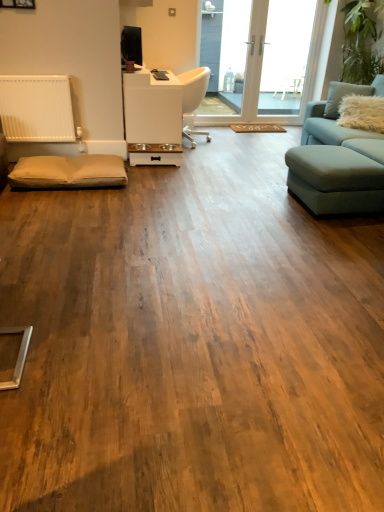
Where is `beige fabric footrest at lower left`? beige fabric footrest at lower left is located at coordinates (68, 172).

You are a GUI agent. You are given a task and a screenshot of the screen. Output one action in this format:
    pyautogui.click(x=<x>, y=<y>)
    Task: Click on the white glossy table at center
    
    Given the screenshot: What is the action you would take?
    pyautogui.click(x=153, y=118)

What do you see at coordinates (153, 118) in the screenshot?
I see `white glossy table at center` at bounding box center [153, 118].

Image resolution: width=384 pixels, height=512 pixels. What do you see at coordinates (262, 67) in the screenshot?
I see `transparent glass door at upper center, the second window screen viewed from the right` at bounding box center [262, 67].

I want to click on beige fabric footrest at lower left, so click(x=68, y=172).

Considering the positions of points (326, 11) and (124, 167), is point (326, 11) closer to camera compared to point (124, 167)?

No.

Who is shorter, transparent glass door at upper center, placed as the first window screen when sorted from left to right, or beige fabric footrest at lower left?

beige fabric footrest at lower left.

Measure the distance between beige fabric footrest at lower left and light blue fabric couch at right.

beige fabric footrest at lower left and light blue fabric couch at right are 1.88 meters apart from each other.

Is beige fabric footrest at lower left bigger or smaller than light blue fabric couch at right?

Clearly, beige fabric footrest at lower left is smaller in size than light blue fabric couch at right.

Based on the photo, is beige fabric footrest at lower left positioned before light blue fabric couch at right?

No, the depth of beige fabric footrest at lower left is greater than that of light blue fabric couch at right.

Which of these two, beige fabric footrest at lower left or light blue fabric couch at right, is wider?

light blue fabric couch at right is wider.

Are transparent glass door at upper center, placed as the first window screen when sorted from left to right, and fuzzy white pillow at upper right making contact?

No.

From a real-world perspective, relative to fuzzy white pillow at upper right, is transparent glass door at upper center, the second window screen viewed from the right, vertically above or below?

transparent glass door at upper center, the second window screen viewed from the right, is above fuzzy white pillow at upper right.

Does transparent glass door at upper center, the second window screen viewed from the right, contain fuzzy white pillow at upper right?

No, fuzzy white pillow at upper right is not surrounded by transparent glass door at upper center, the second window screen viewed from the right.

Which object is wider, transparent glass door at upper center, placed as the first window screen when sorted from left to right, or fuzzy white pillow at upper right?

With larger width is fuzzy white pillow at upper right.

Considering the relative positions of light blue fabric couch at right and transparent glass door at upper center, the second window screen viewed from the right, in the image provided, is light blue fabric couch at right to the right of transparent glass door at upper center, the second window screen viewed from the right, from the viewer's perspective?

Yes, light blue fabric couch at right is to the right of transparent glass door at upper center, the second window screen viewed from the right.

Which is more distant, (379,94) or (259,28)?

Positioned behind is point (259,28).

From a real-world perspective, which is physically below, light blue fabric couch at right or transparent glass door at upper center, the second window screen viewed from the right?

light blue fabric couch at right.

Is light blue fabric couch at right thinner than transparent glass door at upper center, placed as the first window screen when sorted from left to right?

No, light blue fabric couch at right is not thinner than transparent glass door at upper center, placed as the first window screen when sorted from left to right.

Is fuzzy white pillow at upper right aimed at white glossy table at center?

No, fuzzy white pillow at upper right is not turned towards white glossy table at center.

From the image's perspective, is fuzzy white pillow at upper right located above or below white glossy table at center?

fuzzy white pillow at upper right is situated higher than white glossy table at center in the image.

In terms of width, does fuzzy white pillow at upper right look wider or thinner when compared to white glossy table at center?

Considering their sizes, fuzzy white pillow at upper right looks slimmer than white glossy table at center.

Visually, is fuzzy white pillow at upper right positioned to the left or to the right of white glossy table at center?

In the image, fuzzy white pillow at upper right appears on the right side of white glossy table at center.

Is fuzzy white pillow at upper right smaller than transparent glass door at upper center, placed as the first window screen when sorted from left to right?

Yes.

How many degrees apart are the facing directions of fuzzy white pillow at upper right and transparent glass door at upper center, the second window screen viewed from the right?

The angle between the facing direction of fuzzy white pillow at upper right and the facing direction of transparent glass door at upper center, the second window screen viewed from the right, is 20.8 degrees.

Which is more to the right, fuzzy white pillow at upper right or transparent glass door at upper center, placed as the first window screen when sorted from left to right?

From the viewer's perspective, fuzzy white pillow at upper right appears more on the right side.

Choose the correct answer: Is fuzzy white pillow at upper right inside transparent glass door at upper center, placed as the first window screen when sorted from left to right, or outside it?

The correct answer is: outside.

Is beige fabric footrest at lower left oriented towards transparent glass door at upper center, the second window screen viewed from the right?

No.

From the image's perspective, which is above, beige fabric footrest at lower left or transparent glass door at upper center, placed as the first window screen when sorted from left to right?

From the image's view, transparent glass door at upper center, placed as the first window screen when sorted from left to right, is above.

Could transparent glass door at upper center, placed as the first window screen when sorted from left to right, be considered to be inside beige fabric footrest at lower left?

Definitely not — transparent glass door at upper center, placed as the first window screen when sorted from left to right, is not inside beige fabric footrest at lower left.

This screenshot has width=384, height=512. I want to click on the footrest directly beneath the transparent glass door at upper center, the second window screen viewed from the right (from a real-world perspective), so click(x=68, y=172).

This screenshot has width=384, height=512. In order to click on footrest behind the light blue fabric couch at right in this screenshot , I will do `click(68, 172)`.

Looking at the image, which one is located closer to beige fabric footrest at lower left, white glossy table at center or transparent glass door at upper right, marked as the 2th window screen in a left-to-right arrangement?

white glossy table at center is closer to beige fabric footrest at lower left.

Which object lies nearer to the anchor point light blue fabric couch at right, fuzzy white pillow at upper right or beige fabric footrest at lower left?

The object closer to light blue fabric couch at right is fuzzy white pillow at upper right.

Based on their spatial positions, is white plastic chair at center or white glossy table at center closer to beige fabric footrest at lower left?

The object closer to beige fabric footrest at lower left is white glossy table at center.

In the scene shown: Considering their positions, is fuzzy white pillow at upper right positioned closer to beige fabric footrest at lower left than transparent glass door at upper center, the second window screen viewed from the right?

transparent glass door at upper center, the second window screen viewed from the right, is closer to beige fabric footrest at lower left.

Estimate the real-world distances between objects in this image. Which object is further from transparent glass door at upper right, marked as the 2th window screen in a left-to-right arrangement, light blue fabric couch at right or white plastic chair at center?

Based on the image, light blue fabric couch at right appears to be further to transparent glass door at upper right, marked as the 2th window screen in a left-to-right arrangement.

Looking at the image, which one is located closer to beige fabric footrest at lower left, light blue fabric couch at right or white plastic chair at center?

light blue fabric couch at right lies closer to beige fabric footrest at lower left than the other object.

Estimate the real-world distances between objects in this image. Which object is further from light blue fabric couch at right, white plastic chair at center or transparent glass door at upper center, the second window screen viewed from the right?

Among the two, white plastic chair at center is located further to light blue fabric couch at right.

When comparing their distances from white glossy table at center, does beige fabric footrest at lower left or fuzzy white pillow at upper right seem closer?

beige fabric footrest at lower left is closer to white glossy table at center.

At what (x,y) coordinates should I click in order to perform the action: click on table between beige fabric footrest at lower left and light blue fabric couch at right in the horizontal direction. Please return your answer as a coordinate pair (x, y). Looking at the image, I should click on (153, 118).

This screenshot has width=384, height=512. I want to click on chair between light blue fabric couch at right and transparent glass door at upper right, the first window screen when ordered from right to left, along the z-axis, so click(x=193, y=88).

Find the location of a particular element. The width and height of the screenshot is (384, 512). window screen located between fuzzy white pillow at upper right and transparent glass door at upper right, marked as the 2th window screen in a left-to-right arrangement, in the depth direction is located at coordinates (262, 67).

Where is `chair located between white glossy table at center and transparent glass door at upper center, the second window screen viewed from the right, in the left-right direction`? chair located between white glossy table at center and transparent glass door at upper center, the second window screen viewed from the right, in the left-right direction is located at coordinates click(193, 88).